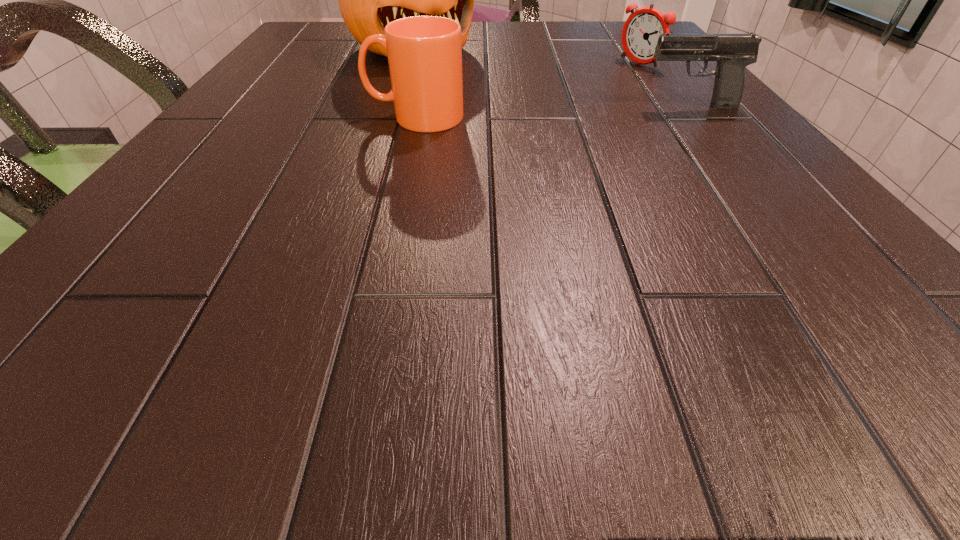
Locate an element on the screen. This screenshot has width=960, height=540. object that is at the far left corner is located at coordinates (368, 0).

At what (x,y) coordinates should I click in order to perform the action: click on vacant space at the far edge. Please return your answer as a coordinate pair (x, y). This screenshot has width=960, height=540. Looking at the image, I should click on coord(535,46).

Locate an element on the screen. This screenshot has height=540, width=960. vacant space at the near edge of the desktop is located at coordinates (273, 271).

The image size is (960, 540). Find the location of `free space at the left edge of the desktop`. free space at the left edge of the desktop is located at coordinates coord(191,222).

Locate an element on the screen. The height and width of the screenshot is (540, 960). vacant space at the right edge of the desktop is located at coordinates (694, 98).

Where is `vacant space at the far left corner of the desktop`? vacant space at the far left corner of the desktop is located at coordinates (310, 37).

The image size is (960, 540). What are the coordinates of `free region at the near left corner` in the screenshot? It's located at (210, 284).

Identify the location of free space at the far right corner. Image resolution: width=960 pixels, height=540 pixels. (609, 30).

The image size is (960, 540). Find the location of `free space between the tallest object and the alarm clock`. free space between the tallest object and the alarm clock is located at coordinates (525, 56).

Find the location of `free spot between the alarm clock and the pistol`. free spot between the alarm clock and the pistol is located at coordinates click(664, 85).